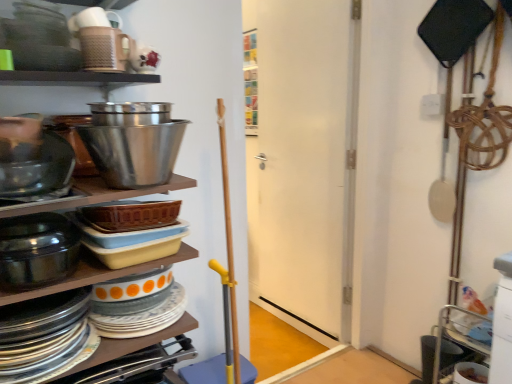
Question: Is shiny metallic bowl at upper center, arranged as the 3th bowl when ordered from the bottom, located within white matte door at center?

Choices:
 (A) no
 (B) yes

Answer: (A)

Question: Does white matte door at center appear on the left side of shiny metallic bowl at upper center, marked as the 1th bowl in a top-to-bottom arrangement?

Choices:
 (A) yes
 (B) no

Answer: (B)

Question: Is white matte door at center not close to shiny metallic bowl at upper center, arranged as the 3th bowl when ordered from the bottom?

Choices:
 (A) yes
 (B) no

Answer: (A)

Question: Is white matte door at center in front of shiny metallic bowl at upper center, arranged as the 3th bowl when ordered from the bottom?

Choices:
 (A) no
 (B) yes

Answer: (A)

Question: Can you confirm if white matte door at center is bigger than shiny metallic bowl at upper center, arranged as the 3th bowl when ordered from the bottom?

Choices:
 (A) no
 (B) yes

Answer: (B)

Question: From a real-world perspective, is white matte door at center positioned over shiny metallic bowl at upper center, arranged as the 3th bowl when ordered from the bottom, based on gravity?

Choices:
 (A) yes
 (B) no

Answer: (B)

Question: From the image's perspective, is shiny metallic bowl at upper center, marked as the 1th bowl in a top-to-bottom arrangement, on top of matte black bowl at left, acting as the 2th bowl starting from the top?

Choices:
 (A) yes
 (B) no

Answer: (A)

Question: Is shiny metallic bowl at upper center, arranged as the 3th bowl when ordered from the bottom, closer to the viewer compared to matte black bowl at left, acting as the 2th bowl starting from the top?

Choices:
 (A) no
 (B) yes

Answer: (B)

Question: Can you confirm if shiny metallic bowl at upper center, arranged as the 3th bowl when ordered from the bottom, is wider than matte black bowl at left, acting as the 2th bowl starting from the bottom?

Choices:
 (A) yes
 (B) no

Answer: (B)

Question: Is shiny metallic bowl at upper center, marked as the 1th bowl in a top-to-bottom arrangement, oriented towards matte black bowl at left, acting as the 2th bowl starting from the top?

Choices:
 (A) yes
 (B) no

Answer: (B)

Question: Is shiny metallic bowl at upper center, arranged as the 3th bowl when ordered from the bottom, surrounding matte black bowl at left, acting as the 2th bowl starting from the top?

Choices:
 (A) no
 (B) yes

Answer: (A)

Question: Can you confirm if shiny metallic bowl at upper center, marked as the 1th bowl in a top-to-bottom arrangement, is positioned to the right of matte black bowl at left, acting as the 2th bowl starting from the bottom?

Choices:
 (A) yes
 (B) no

Answer: (A)

Question: Can you confirm if shiny metallic bowl at left, the third bowl in the top-to-bottom sequence, is bigger than shiny metallic bowl at upper center, arranged as the 3th bowl when ordered from the bottom?

Choices:
 (A) no
 (B) yes

Answer: (A)